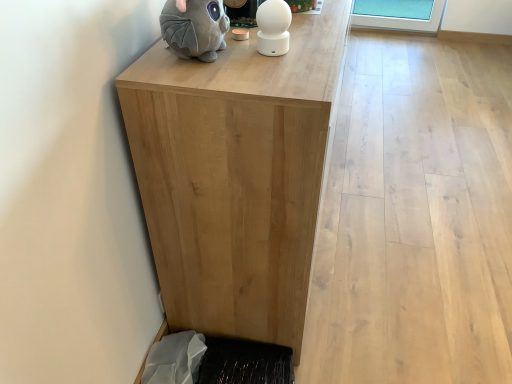
What are the coordinates of `vacant space in front of gray plush toy at upper left` in the screenshot? It's located at (x=211, y=82).